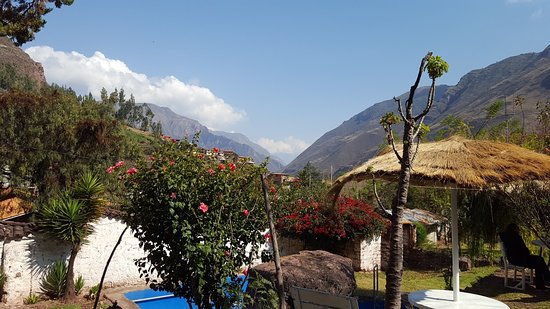
I want to click on terra cotta tile, so click(16, 234).